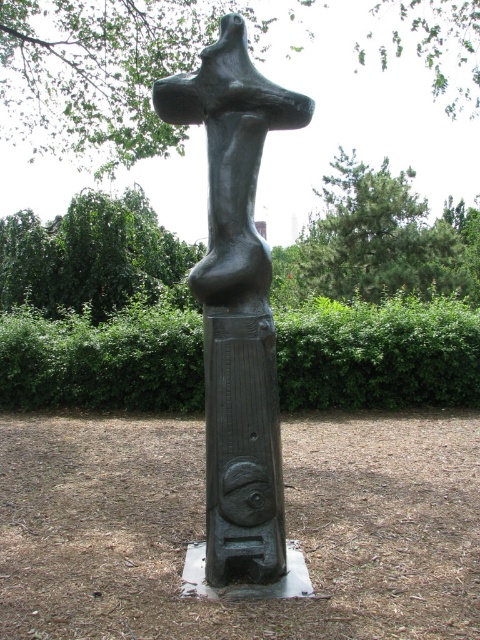
You are a gardener who needs to trim the green leafy hedge at center and the bronze statue at center. Which object should you work on first if you want to start with the one closer to the ground?

The green leafy hedge at center is located below the bronze statue at center, so you should trim the green leafy hedge at center first since it is closer to the ground.

You are standing in front of the sculpture and want to take a photo that includes both the bronze statue at center and the green polished stone pole at center. Which object should you position closer to the camera to ensure both are in focus?

The bronze statue at center is closer to the viewer than the green polished stone pole at center. To ensure both are in focus, position the camera so the bronze statue at center is closer to the lens since it is already nearer, allowing the depth of field to cover both objects.

From the picture: You are standing in a park and see the green leafy hedge at center and the bronze statue at center. Which one is positioned to the left of the other?

The green leafy hedge at center is to the left of the bronze statue at center.